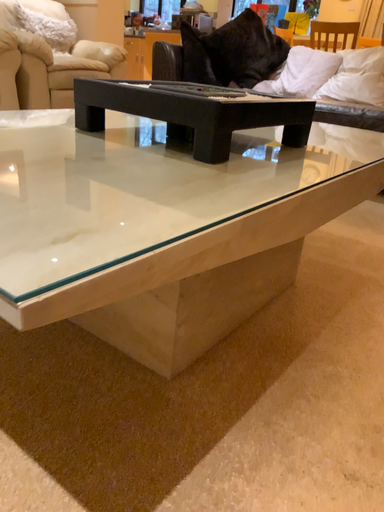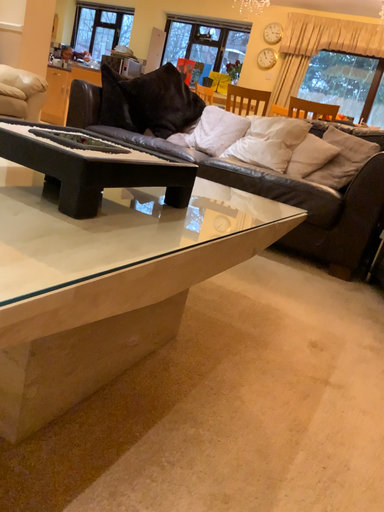
Question: Which way did the camera rotate in the video?

Choices:
 (A) rotated right
 (B) rotated left

Answer: (A)